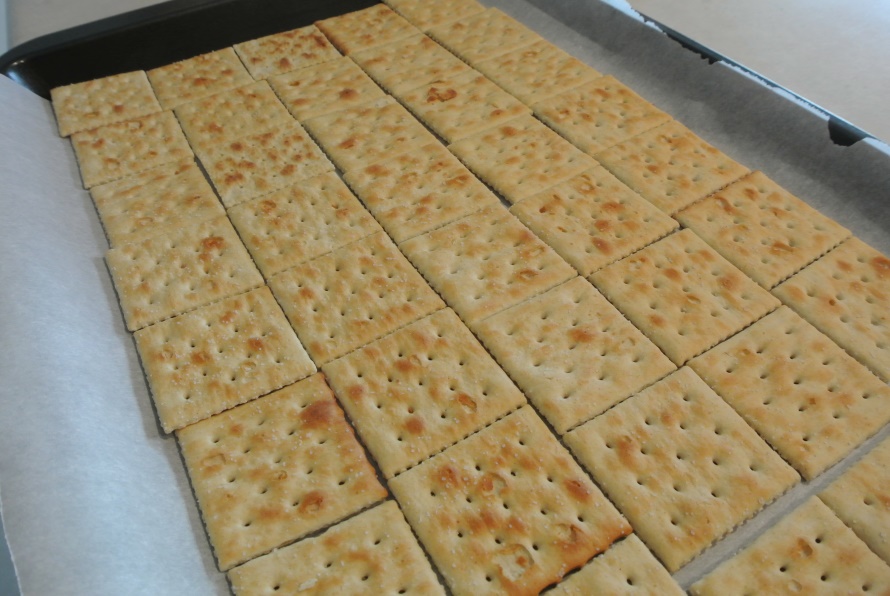
The height and width of the screenshot is (596, 890). Identify the location of counter. (821, 52), (38, 18).